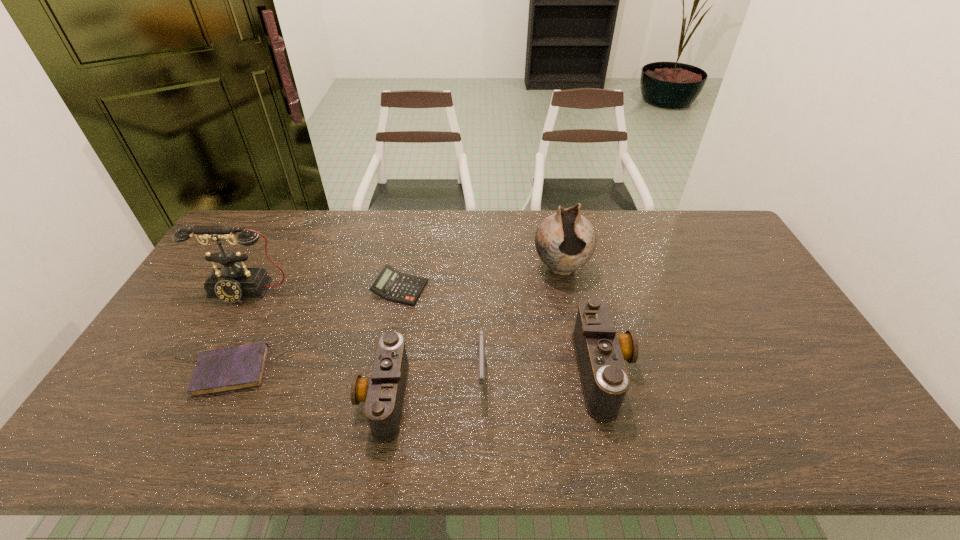
All cameras are currently evenly spaced. To continue this pattern, where would you add another camera on the right? Please point out a vacant spot. Please provide its 2D coordinates. Your answer should be formatted as a tuple, i.e. [(x, y)], where the tuple contains the x and y coordinates of a point satisfying the conditions above.

[(802, 348)]